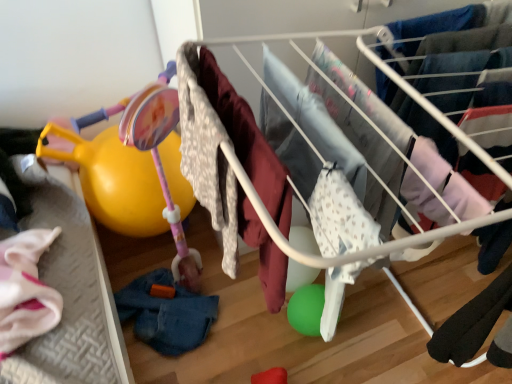
Question: From a real-world perspective, is denim at lower left, which is the second clothing from front to back, over matte pink plastic baby carriage at left?

Choices:
 (A) no
 (B) yes

Answer: (A)

Question: Can you confirm if denim at lower left, arranged as the first clothing when ordered from the bottom, is positioned to the left of matte pink plastic baby carriage at left?

Choices:
 (A) no
 (B) yes

Answer: (A)

Question: Considering the relative sizes of denim at lower left, the 1th clothing when ordered from back to front, and matte pink plastic baby carriage at left in the image provided, is denim at lower left, the 1th clothing when ordered from back to front, shorter than matte pink plastic baby carriage at left?

Choices:
 (A) yes
 (B) no

Answer: (A)

Question: Does denim at lower left, the 1th clothing when ordered from back to front, have a larger size compared to matte pink plastic baby carriage at left?

Choices:
 (A) yes
 (B) no

Answer: (B)

Question: Considering the relative sizes of denim at lower left, the 1th clothing when ordered from back to front, and matte pink plastic baby carriage at left in the image provided, is denim at lower left, the 1th clothing when ordered from back to front, thinner than matte pink plastic baby carriage at left?

Choices:
 (A) no
 (B) yes

Answer: (A)

Question: In terms of height, does fluffy white blanket at center, the 2th clothing in the left-to-right sequence, look taller or shorter compared to denim at lower left, which is the 2th clothing in top-to-bottom order?

Choices:
 (A) short
 (B) tall

Answer: (B)

Question: In the image, is fluffy white blanket at center, the 1th clothing viewed from the top, positioned in front of or behind denim at lower left, which is the 2th clothing in top-to-bottom order?

Choices:
 (A) front
 (B) behind

Answer: (A)

Question: Is fluffy white blanket at center, acting as the second clothing starting from the back, situated inside denim at lower left, the 1th clothing when ordered from back to front, or outside?

Choices:
 (A) outside
 (B) inside

Answer: (A)

Question: Looking at their shapes, would you say fluffy white blanket at center, the 2th clothing in the left-to-right sequence, is wider or thinner than denim at lower left, which is counted as the first clothing, starting from the left?

Choices:
 (A) wide
 (B) thin

Answer: (A)

Question: Is fluffy white blanket at center, which is the 1th clothing from front to back, spatially inside white fabric baby clothes at center, or outside of it?

Choices:
 (A) outside
 (B) inside

Answer: (A)

Question: Is fluffy white blanket at center, the 1th clothing when ordered from right to left, in front of or behind white fabric baby clothes at center in the image?

Choices:
 (A) behind
 (B) front

Answer: (B)

Question: From a real-world perspective, is fluffy white blanket at center, the second clothing when ordered from bottom to top, physically located above or below white fabric baby clothes at center?

Choices:
 (A) below
 (B) above

Answer: (B)

Question: Is point (276, 173) positioned closer to the camera than point (422, 205)?

Choices:
 (A) closer
 (B) farther

Answer: (A)

Question: From their relative heights in the image, would you say matte pink plastic baby carriage at left is taller or shorter than fluffy white blanket at center, the 2th clothing in the left-to-right sequence?

Choices:
 (A) short
 (B) tall

Answer: (A)

Question: Would you say matte pink plastic baby carriage at left is to the left or to the right of fluffy white blanket at center, which is the 1th clothing from front to back, in the picture?

Choices:
 (A) left
 (B) right

Answer: (A)